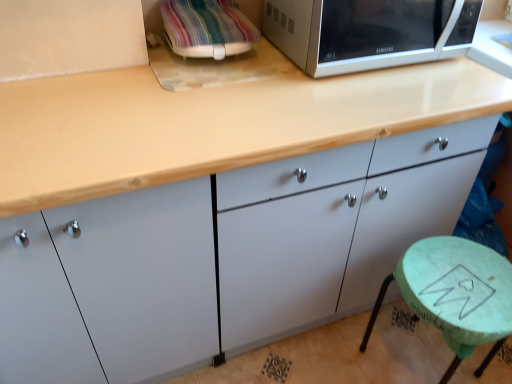
What do you see at coordinates (455, 294) in the screenshot? The height and width of the screenshot is (384, 512). I see `green marble stool at lower right` at bounding box center [455, 294].

Identify the location of multicolored fabric-covered microwave at upper right. (207, 28).

In order to click on green marble stool at lower right in this screenshot , I will do `click(455, 294)`.

From the picture: From a real-world perspective, is green marble stool at lower right located beneath multicolored fabric-covered microwave at upper right?

Yes.

From the image's perspective, is green marble stool at lower right above or below multicolored fabric-covered microwave at upper right?

Based on their image positions, green marble stool at lower right is located beneath multicolored fabric-covered microwave at upper right.

Choose the correct answer: Is green marble stool at lower right inside multicolored fabric-covered microwave at upper right or outside it?

green marble stool at lower right lies outside multicolored fabric-covered microwave at upper right.

Which object is positioned more to the left, green marble stool at lower right or multicolored fabric-covered microwave at upper right?

multicolored fabric-covered microwave at upper right.

Which object is closer to the camera, satin silver microwave at upper right or matte white cabinet at center?

Positioned in front is matte white cabinet at center.

Are satin silver microwave at upper right and matte white cabinet at center far apart?

No, satin silver microwave at upper right is not far from matte white cabinet at center.

Which object is positioned more to the right, satin silver microwave at upper right or matte white cabinet at center?

From the viewer's perspective, satin silver microwave at upper right appears more on the right side.

Based on the photo, can you confirm if satin silver microwave at upper right is smaller than matte white cabinet at center?

Yes, satin silver microwave at upper right is smaller than matte white cabinet at center.

Are green marble stool at lower right and matte white cabinet at center making contact?

green marble stool at lower right is not next to matte white cabinet at center, and they're not touching.

Is green marble stool at lower right surrounding matte white cabinet at center?

Actually, matte white cabinet at center is outside green marble stool at lower right.

The width and height of the screenshot is (512, 384). I want to click on round table behind the matte white cabinet at center, so click(x=455, y=294).

Is green marble stool at lower right oriented towards matte white cabinet at center?

No.

Between multicolored fabric-covered microwave at upper right and matte white cabinet at center, which one appears on the left side from the viewer's perspective?

multicolored fabric-covered microwave at upper right.

Is multicolored fabric-covered microwave at upper right shorter than matte white cabinet at center?

Yes.

Can you tell me how much multicolored fabric-covered microwave at upper right and matte white cabinet at center differ in facing direction?

0.214 degrees separate the facing orientations of multicolored fabric-covered microwave at upper right and matte white cabinet at center.

Which object is further away from the camera, multicolored fabric-covered microwave at upper right or matte white cabinet at center?

multicolored fabric-covered microwave at upper right is further away from the camera.

From a real-world perspective, is multicolored fabric-covered microwave at upper right physically located above or below green marble stool at lower right?

multicolored fabric-covered microwave at upper right is above green marble stool at lower right.

Is multicolored fabric-covered microwave at upper right at the right side of green marble stool at lower right?

Result: No.

How far apart are multicolored fabric-covered microwave at upper right and green marble stool at lower right?

multicolored fabric-covered microwave at upper right is 33.37 inches from green marble stool at lower right.

Where is `appliance behind the green marble stool at lower right`? appliance behind the green marble stool at lower right is located at coordinates (207, 28).

Is matte white cabinet at center not near green marble stool at lower right?

That's not correct — matte white cabinet at center is a little close to green marble stool at lower right.

Considering the positions of point (409, 228) and point (485, 276), is point (409, 228) closer or farther from the camera than point (485, 276)?

Point (409, 228).

Considering the relative sizes of matte white cabinet at center and green marble stool at lower right in the image provided, is matte white cabinet at center taller than green marble stool at lower right?

Correct, matte white cabinet at center is much taller as green marble stool at lower right.

Find the location of a particular element. This screenshot has height=384, width=512. cabinetry in front of the green marble stool at lower right is located at coordinates (223, 257).

Which is in front, satin silver microwave at upper right or multicolored fabric-covered microwave at upper right?

satin silver microwave at upper right is more forward.

How different are the orientations of satin silver microwave at upper right and multicolored fabric-covered microwave at upper right in degrees?

They differ by 1.57 degrees in their facing directions.

From the image's perspective, is satin silver microwave at upper right located above or below multicolored fabric-covered microwave at upper right?

Based on their image positions, satin silver microwave at upper right is located above multicolored fabric-covered microwave at upper right.

Between satin silver microwave at upper right and multicolored fabric-covered microwave at upper right, which one appears on the left side from the viewer's perspective?

From the viewer's perspective, multicolored fabric-covered microwave at upper right appears more on the left side.

At what (x,y) coordinates should I click in order to perform the action: click on appliance lying behind the green marble stool at lower right. Please return your answer as a coordinate pair (x, y). Looking at the image, I should click on (207, 28).

At what (x,y) coordinates should I click in order to perform the action: click on cabinetry lying below the satin silver microwave at upper right (from the image's perspective). Please return your answer as a coordinate pair (x, y). Looking at the image, I should click on (223, 257).

Considering their positions, is matte white cabinet at center positioned closer to multicolored fabric-covered microwave at upper right than satin silver microwave at upper right?

satin silver microwave at upper right lies closer to multicolored fabric-covered microwave at upper right than the other object.

Based on their spatial positions, is satin silver microwave at upper right or multicolored fabric-covered microwave at upper right further from green marble stool at lower right?

multicolored fabric-covered microwave at upper right lies further to green marble stool at lower right than the other object.

When comparing their distances from matte white cabinet at center, does multicolored fabric-covered microwave at upper right or satin silver microwave at upper right seem further?

multicolored fabric-covered microwave at upper right is further to matte white cabinet at center.

From the picture: Estimate the real-world distances between objects in this image. Which object is further from green marble stool at lower right, satin silver microwave at upper right or matte white cabinet at center?

satin silver microwave at upper right.

Considering their positions, is multicolored fabric-covered microwave at upper right positioned further to green marble stool at lower right than satin silver microwave at upper right?

Among the two, multicolored fabric-covered microwave at upper right is located further to green marble stool at lower right.

Estimate the real-world distances between objects in this image. Which object is closer to satin silver microwave at upper right, matte white cabinet at center or multicolored fabric-covered microwave at upper right?

multicolored fabric-covered microwave at upper right.

Looking at the image, which one is located closer to multicolored fabric-covered microwave at upper right, satin silver microwave at upper right or green marble stool at lower right?

satin silver microwave at upper right.

Based on their spatial positions, is green marble stool at lower right or multicolored fabric-covered microwave at upper right further from matte white cabinet at center?

Among the two, multicolored fabric-covered microwave at upper right is located further to matte white cabinet at center.

At what (x,y) coordinates should I click in order to perform the action: click on appliance between satin silver microwave at upper right and matte white cabinet at center from top to bottom. Please return your answer as a coordinate pair (x, y). Image resolution: width=512 pixels, height=384 pixels. Looking at the image, I should click on (207, 28).

Find the location of a particular element. Image resolution: width=512 pixels, height=384 pixels. cabinetry between satin silver microwave at upper right and green marble stool at lower right vertically is located at coordinates coord(223,257).

Identify the location of appliance between satin silver microwave at upper right and green marble stool at lower right in the vertical direction. (207, 28).

At what (x,y) coordinates should I click in order to perform the action: click on cabinetry that lies between multicolored fabric-covered microwave at upper right and green marble stool at lower right from top to bottom. Please return your answer as a coordinate pair (x, y). The image size is (512, 384). Looking at the image, I should click on (223, 257).